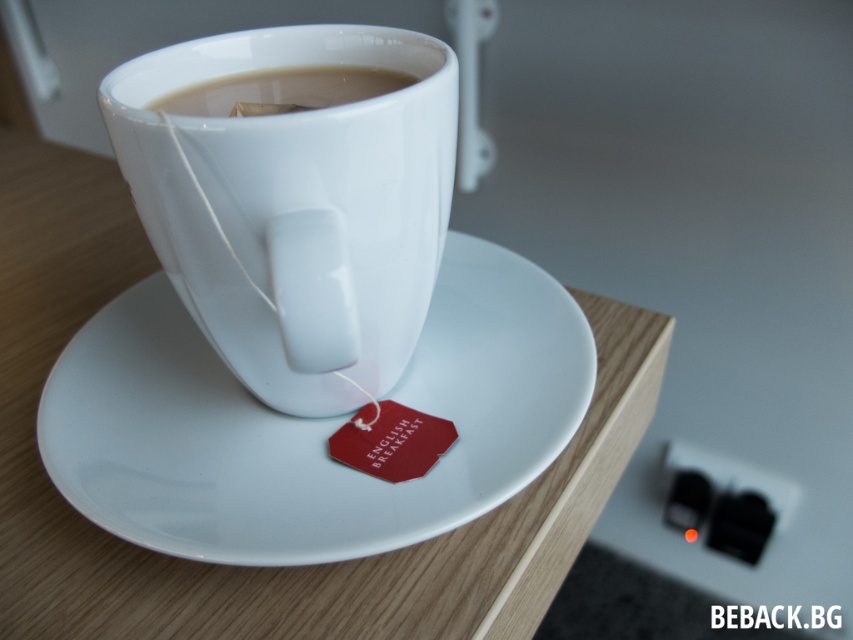
Which is behind, point (207, 288) or point (265, 86)?

The point (265, 86) is more distant.

Which is above, white glossy mug at center or white glossy cup at upper center?

white glossy cup at upper center is higher up.

Between point (393, 113) and point (375, 70), which one is positioned in front?

Positioned in front is point (393, 113).

The width and height of the screenshot is (853, 640). What are the coordinates of `white glossy mug at center` in the screenshot? It's located at (294, 198).

Which of these two, white glossy mug at center or white ceramic saucer at center, stands shorter?

white ceramic saucer at center

Between point (236, 88) and point (164, 352), which one is positioned behind?

Positioned behind is point (164, 352).

Who is more forward, (372, 179) or (160, 451)?

Point (372, 179) is in front.

The image size is (853, 640). Identify the location of white glossy mug at center. (294, 198).

Who is positioned more to the left, white ceramic saucer at center or white glossy cup at upper center?

From the viewer's perspective, white glossy cup at upper center appears more on the left side.

Is white ceramic saucer at center below white glossy cup at upper center?

Correct, white ceramic saucer at center is located below white glossy cup at upper center.

Where is `white ceramic saucer at center`? white ceramic saucer at center is located at coordinates (311, 422).